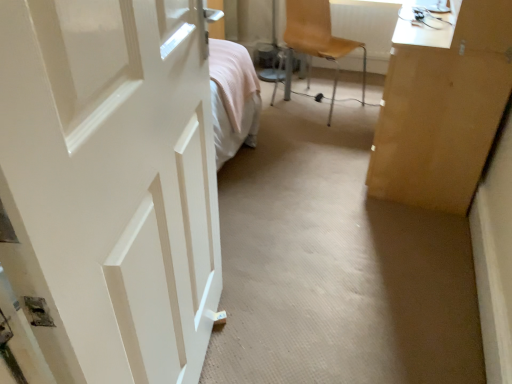
You are a GUI agent. You are given a task and a screenshot of the screen. Output one action in this format:
    pyautogui.click(x=<x>, y=<y>)
    Task: Click on the free spot in front of light brown wooden chair at center
    
    Given the screenshot: What is the action you would take?
    pyautogui.click(x=320, y=138)